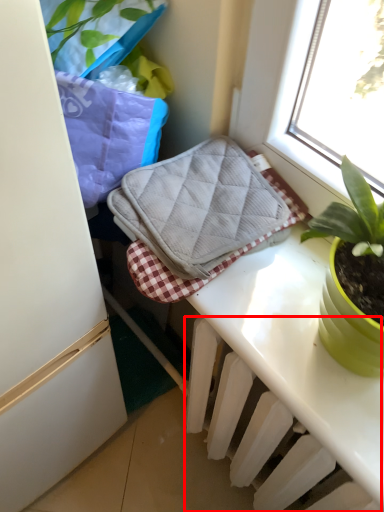
Question: From the image's perspective, what is the correct spatial relationship of radiator (annotated by the red box) in relation to bath towel?

Choices:
 (A) below
 (B) above

Answer: (A)